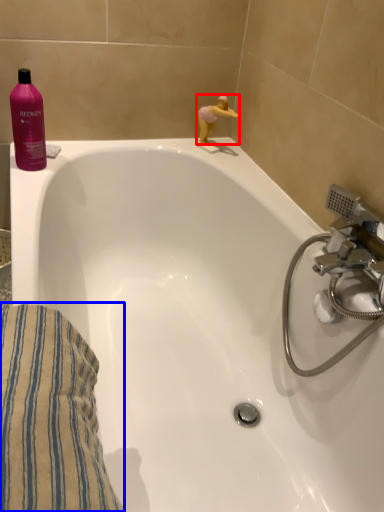
Question: Which of the following is the farthest to the observer, miniature (highlighted by a red box) or bath towel (highlighted by a blue box)?

Choices:
 (A) miniature
 (B) bath towel

Answer: (A)